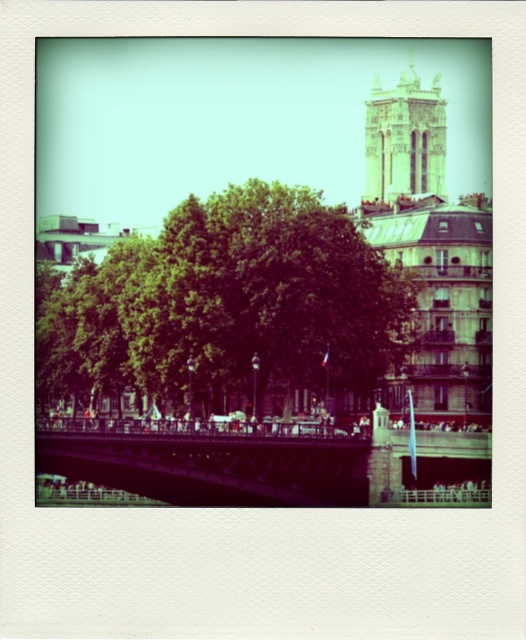
You are standing at the center of the bridge and want to locate the green leafy tree at center. According to the coordinates provided, in which direction should you look to find it?

The green leafy tree at center is located at coordinates point (227, 307), so you should look towards the center of the image to find it.

You are a photographer planning to take a photo of the golden stone bell tower at upper right. However, you notice the metallic bridge at center is blocking your view. Can you position yourself in such a way that the bridge is no longer obstructing the tower?

The metallic bridge at center is in front of the golden stone bell tower at upper right, so you can move to the side of the bridge to capture the tower without obstruction.